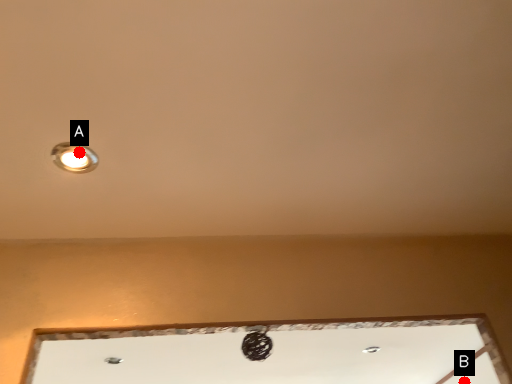
Question: Two points are circled on the image, labeled by A and B beside each circle. Which point is farther from the camera taking this photo?

Choices:
 (A) A is further
 (B) B is further

Answer: (B)